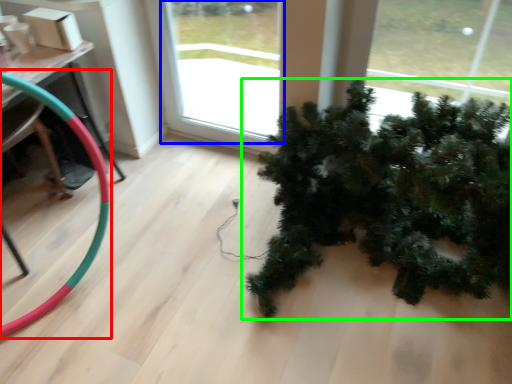
Question: Considering the real-world distances, which object is closest to garden hose (highlighted by a red box)? window (highlighted by a blue box) or houseplant (highlighted by a green box).

Choices:
 (A) window
 (B) houseplant

Answer: (B)